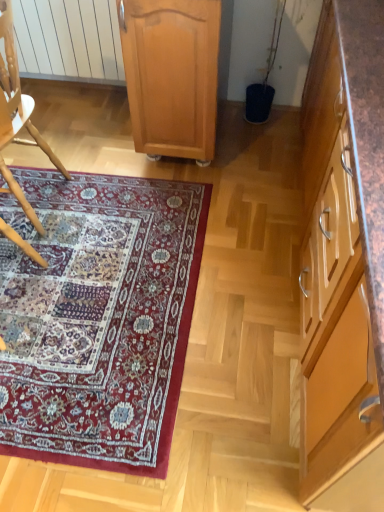
Where is `vacant space to the right of carpet with intricate patterns at lower left`? vacant space to the right of carpet with intricate patterns at lower left is located at coordinates (247, 280).